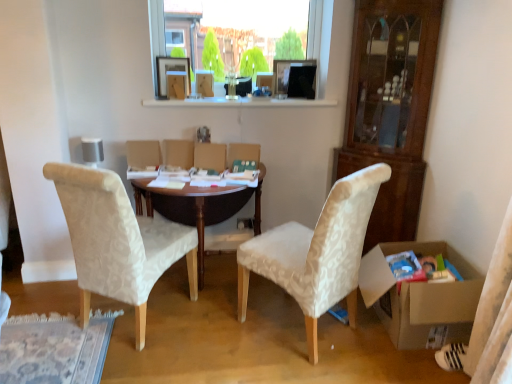
What is the approximate width of transparent glass window at upper center?

The width of transparent glass window at upper center is 11.35 centimeters.

Measure the distance between transparent glass window at upper center and camera.

They are 9.24 feet apart.

The height and width of the screenshot is (384, 512). Find the location of `beige fabric chair at left, which is the first chair from left to right`. beige fabric chair at left, which is the first chair from left to right is located at coordinates click(x=117, y=241).

The width and height of the screenshot is (512, 384). What do you see at coordinates (199, 207) in the screenshot?
I see `brown wooden table at center` at bounding box center [199, 207].

You are a GUI agent. You are given a task and a screenshot of the screen. Output one action in this format:
    pyautogui.click(x=<x>, y=<y>)
    Task: Click on the patterned fabric chair at center, the first chair viewed from the right
    This screenshot has height=384, width=512.
    Given the screenshot: What is the action you would take?
    pyautogui.click(x=317, y=252)

Describe the element at coordinates (317, 252) in the screenshot. Image resolution: width=512 pixels, height=384 pixels. I see `patterned fabric chair at center, the first chair viewed from the right` at that location.

The image size is (512, 384). I want to click on cardboard box at lower right, so click(x=423, y=297).

Find the location of a particular element. This screenshot has height=384, width=512. wooden picture frame at upper center is located at coordinates (170, 70).

Could you measure the distance between beige fabric chair at left, which is the 2th chair from right to left, and patterned fabric chair at center, which is the 2th chair in left-to-right order?

beige fabric chair at left, which is the 2th chair from right to left, and patterned fabric chair at center, which is the 2th chair in left-to-right order, are 28.20 inches apart.

Considering the relative positions of beige fabric chair at left, which is the 2th chair from right to left, and patterned fabric chair at center, which is the 2th chair in left-to-right order, in the image provided, is beige fabric chair at left, which is the 2th chair from right to left, to the left or to the right of patterned fabric chair at center, which is the 2th chair in left-to-right order,?

From the image, it's evident that beige fabric chair at left, which is the 2th chair from right to left, is to the left of patterned fabric chair at center, which is the 2th chair in left-to-right order.

From the image's perspective, between beige fabric chair at left, which is the 2th chair from right to left, and patterned fabric chair at center, which is the 2th chair in left-to-right order, which one is located above?

beige fabric chair at left, which is the 2th chair from right to left.

Can you confirm if beige fabric chair at left, which is the 2th chair from right to left, is wider than patterned fabric chair at center, which is the 2th chair in left-to-right order?

No.

Between point (312, 38) and point (414, 299), which one is positioned behind?

The point (312, 38) is behind.

Is transparent glass window at upper center positioned beyond the bounds of cardboard box at lower right?

transparent glass window at upper center is positioned outside cardboard box at lower right.

From the image's perspective, who appears lower, transparent glass window at upper center or cardboard box at lower right?

From the image's view, cardboard box at lower right is below.

How much distance is there between transparent glass window at upper center and cardboard box at lower right?

They are 4.69 feet apart.

Between brown wooden table at center and beige fabric chair at left, which is the 2th chair from right to left, which one has smaller size?

beige fabric chair at left, which is the 2th chair from right to left, is smaller.

I want to click on table above the beige fabric chair at left, which is the first chair from left to right (from the image's perspective), so click(199, 207).

Which is further, (185, 207) or (125, 219)?

The point (185, 207) is more distant.

Which of these two, transparent glass window at upper center or patterned fabric chair at center, the first chair viewed from the right, stands shorter?

transparent glass window at upper center.

Is point (320, 56) closer to camera compared to point (369, 209)?

No, it is behind (369, 209).

Considering the relative sizes of transparent glass window at upper center and patterned fabric chair at center, the first chair viewed from the right, in the image provided, is transparent glass window at upper center bigger than patterned fabric chair at center, the first chair viewed from the right,?

No, transparent glass window at upper center is not bigger than patterned fabric chair at center, the first chair viewed from the right.

Can patterned fabric chair at center, which is the 2th chair in left-to-right order, be found inside transparent glass window at upper center?

No, patterned fabric chair at center, which is the 2th chair in left-to-right order, is not a part of transparent glass window at upper center.

From a real-world perspective, between wooden picture frame at upper center and beige fabric chair at left, which is the 2th chair from right to left, who is vertically lower?

beige fabric chair at left, which is the 2th chair from right to left.

Is wooden picture frame at upper center shorter than beige fabric chair at left, which is the 2th chair from right to left?

Correct, wooden picture frame at upper center is not as tall as beige fabric chair at left, which is the 2th chair from right to left.

Consider the image. From a real-world perspective, is wooden picture frame at upper center physically above cardboard box at lower right?

Yes, from a real-world perspective, wooden picture frame at upper center is on top of cardboard box at lower right.

Consider the image. Considering the positions of objects wooden picture frame at upper center and cardboard box at lower right in the image provided, who is in front, wooden picture frame at upper center or cardboard box at lower right?

cardboard box at lower right is more forward.

Is wooden picture frame at upper center to the left or to the right of cardboard box at lower right in the image?

From the image, it's evident that wooden picture frame at upper center is to the left of cardboard box at lower right.

From the picture: Based on their positions, is cardboard box at lower right located to the left or right of wooden picture frame at upper center?

Clearly, cardboard box at lower right is on the right of wooden picture frame at upper center in the image.

Is cardboard box at lower right taller than wooden picture frame at upper center?

Yes, cardboard box at lower right is taller than wooden picture frame at upper center.

From the image's perspective, who appears lower, cardboard box at lower right or wooden picture frame at upper center?

cardboard box at lower right, from the image's perspective.

Identify the location of chair that appears on the right of beige fabric chair at left, which is the first chair from left to right. (317, 252).

At what (x,y) coordinates should I click in order to perform the action: click on window above the cardboard box at lower right (from a real-world perspective). Please return your answer as a coordinate pair (x, y). Looking at the image, I should click on (313, 56).

Estimate the real-world distances between objects in this image. Which object is further from beige fabric chair at left, which is the 2th chair from right to left, wooden picture frame at upper center or brown wooden table at center?

Based on the image, wooden picture frame at upper center appears to be further to beige fabric chair at left, which is the 2th chair from right to left.

Estimate the real-world distances between objects in this image. Which object is further from beige fabric chair at left, which is the 2th chair from right to left, transparent glass window at upper center or patterned fabric chair at center, the first chair viewed from the right?

Based on the image, transparent glass window at upper center appears to be further to beige fabric chair at left, which is the 2th chair from right to left.

From the image, which object appears to be farther from beige fabric chair at left, which is the first chair from left to right, patterned fabric chair at center, the first chair viewed from the right, or brown wooden table at center?

patterned fabric chair at center, the first chair viewed from the right, is positioned further to the anchor beige fabric chair at left, which is the first chair from left to right.

When comparing their distances from patterned fabric chair at center, which is the 2th chair in left-to-right order, does wooden picture frame at upper center or beige fabric chair at left, which is the 2th chair from right to left, seem further?

wooden picture frame at upper center is further to patterned fabric chair at center, which is the 2th chair in left-to-right order.

When comparing their distances from cardboard box at lower right, does wooden picture frame at upper center or patterned fabric chair at center, which is the 2th chair in left-to-right order, seem further?

wooden picture frame at upper center is further to cardboard box at lower right.

When comparing their distances from beige fabric chair at left, which is the 2th chair from right to left, does cardboard box at lower right or brown wooden table at center seem further?

cardboard box at lower right is positioned further to the anchor beige fabric chair at left, which is the 2th chair from right to left.

Estimate the real-world distances between objects in this image. Which object is further from patterned fabric chair at center, which is the 2th chair in left-to-right order, transparent glass window at upper center or cardboard box at lower right?

transparent glass window at upper center is positioned further to the anchor patterned fabric chair at center, which is the 2th chair in left-to-right order.

Looking at the image, which one is located closer to cardboard box at lower right, beige fabric chair at left, which is the first chair from left to right, or transparent glass window at upper center?

Among the two, beige fabric chair at left, which is the first chair from left to right, is located nearer to cardboard box at lower right.

Identify the location of table that lies between transparent glass window at upper center and patterned fabric chair at center, which is the 2th chair in left-to-right order, from top to bottom. Image resolution: width=512 pixels, height=384 pixels. (199, 207).

Find the location of a particular element. The height and width of the screenshot is (384, 512). chair situated between brown wooden table at center and cardboard box at lower right from left to right is located at coordinates (317, 252).

Locate an element on the screen. The image size is (512, 384). table between wooden picture frame at upper center and cardboard box at lower right in the horizontal direction is located at coordinates (199, 207).

Locate an element on the screen. picture frame that lies between transparent glass window at upper center and beige fabric chair at left, which is the first chair from left to right, from top to bottom is located at coordinates (170, 70).